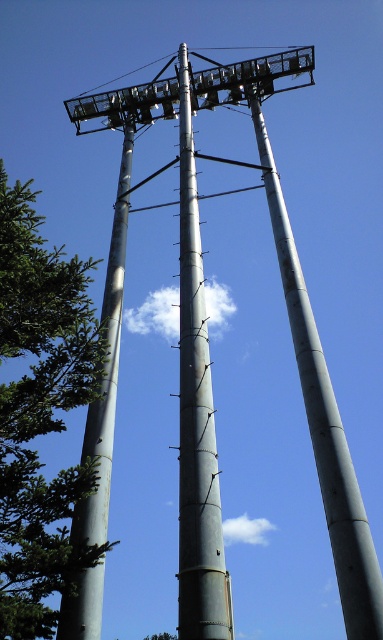
The width and height of the screenshot is (383, 640). I want to click on metallic gray pole at center, so click(196, 419).

Locate an element on the screen. metallic gray pole at center is located at coordinates (196, 419).

Does point (292, 317) lie behind point (137, 68)?

That is False.

Between point (340, 458) and point (80, 93), which one is positioned in front?

Positioned in front is point (340, 458).

Locate an element on the screen. The width and height of the screenshot is (383, 640). smooth metallic pole at center is located at coordinates (324, 424).

Locate an element on the screen. The height and width of the screenshot is (640, 383). smooth metallic pole at center is located at coordinates coord(324,424).

Which of these two, green matte tree at left or silver metallic pole at left, stands taller?

Standing taller between the two is silver metallic pole at left.

Is green matte tree at left closer to the viewer compared to silver metallic pole at left?

Yes, it is.

The width and height of the screenshot is (383, 640). I want to click on green matte tree at left, so click(x=40, y=413).